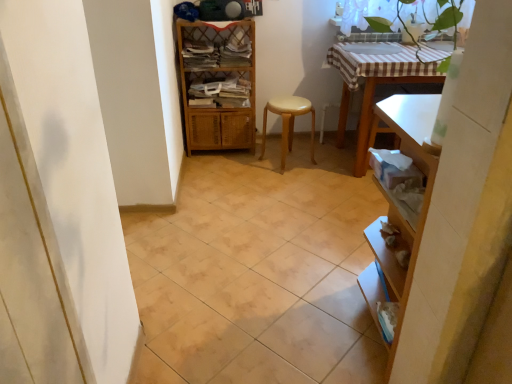
In order to click on free space behind light brown wooden stool at center in this screenshot , I will do `click(303, 146)`.